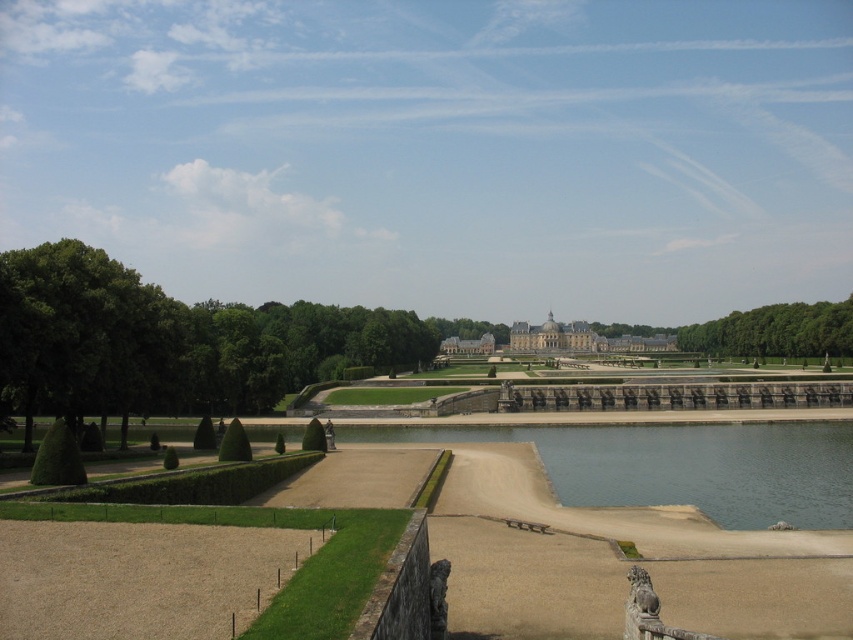
You are a gardener planning to prune the green leafy tree at left and the green leafy hedge at lower left. Which of these two plants requires a ladder for pruning?

The green leafy tree at left requires a ladder for pruning because it is much taller than the green leafy hedge at lower left.

You are a gardener planning to trim the green leafy hedge at lower left and the stone gray palace at center. Which object requires more horizontal space to maintain its current shape?

The stone gray palace at center requires more horizontal space to maintain its current shape since it has a greater width than the green leafy hedge at lower left.